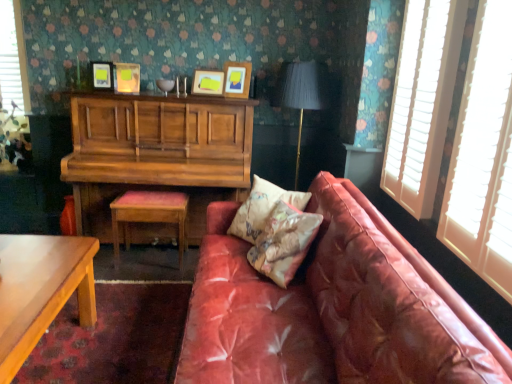
Locate an element on the screen. The width and height of the screenshot is (512, 384). vacant space in front of wooden stool at lower left is located at coordinates (141, 286).